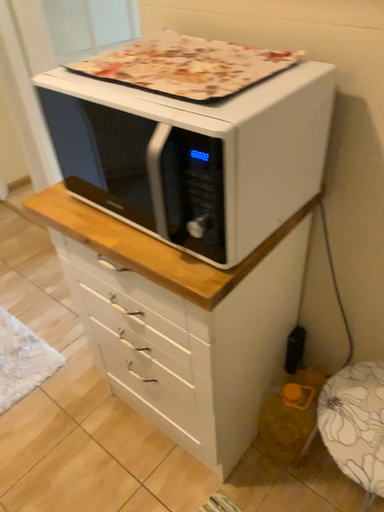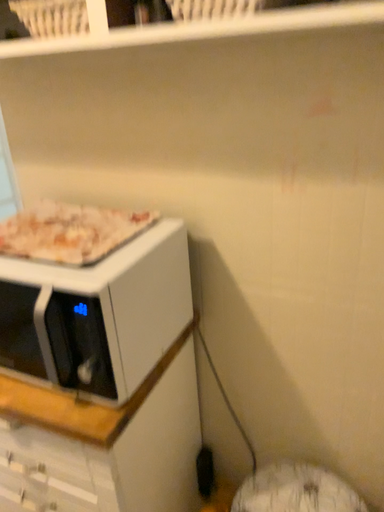
Question: How did the camera likely rotate when shooting the video?

Choices:
 (A) rotated upward
 (B) rotated downward

Answer: (A)